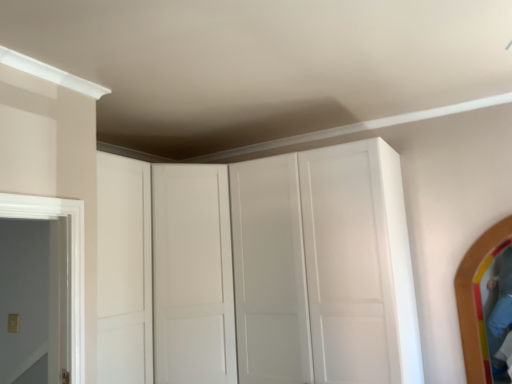
Question: Does point (474, 324) appear closer or farther from the camera than point (117, 306)?

Choices:
 (A) farther
 (B) closer

Answer: (A)

Question: Based on their sizes in the image, would you say wooden mirror at right is bigger or smaller than white matte cabinet at center?

Choices:
 (A) big
 (B) small

Answer: (B)

Question: Considering their positions, is wooden mirror at right located in front of or behind white matte cabinet at center?

Choices:
 (A) front
 (B) behind

Answer: (B)

Question: Is white matte cabinet at center inside the boundaries of wooden mirror at right, or outside?

Choices:
 (A) inside
 (B) outside

Answer: (B)

Question: In the image, is white matte cabinet at center positioned in front of or behind wooden mirror at right?

Choices:
 (A) front
 (B) behind

Answer: (A)

Question: Is white matte cabinet at center taller or shorter than wooden mirror at right?

Choices:
 (A) short
 (B) tall

Answer: (B)

Question: From a real-world perspective, is white matte cabinet at center above or below wooden mirror at right?

Choices:
 (A) above
 (B) below

Answer: (A)